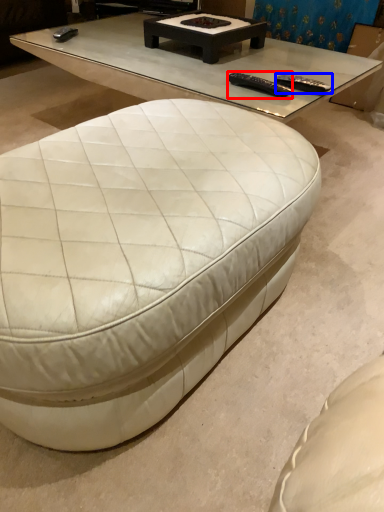
Question: Which point is further to the camera, remote (highlighted by a red box) or remote (highlighted by a blue box)?

Choices:
 (A) remote
 (B) remote

Answer: (B)